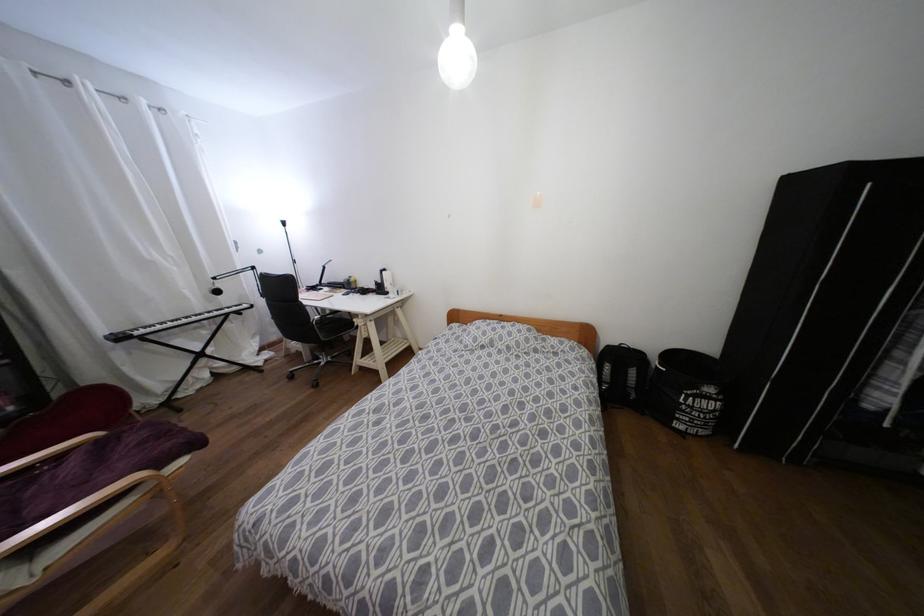
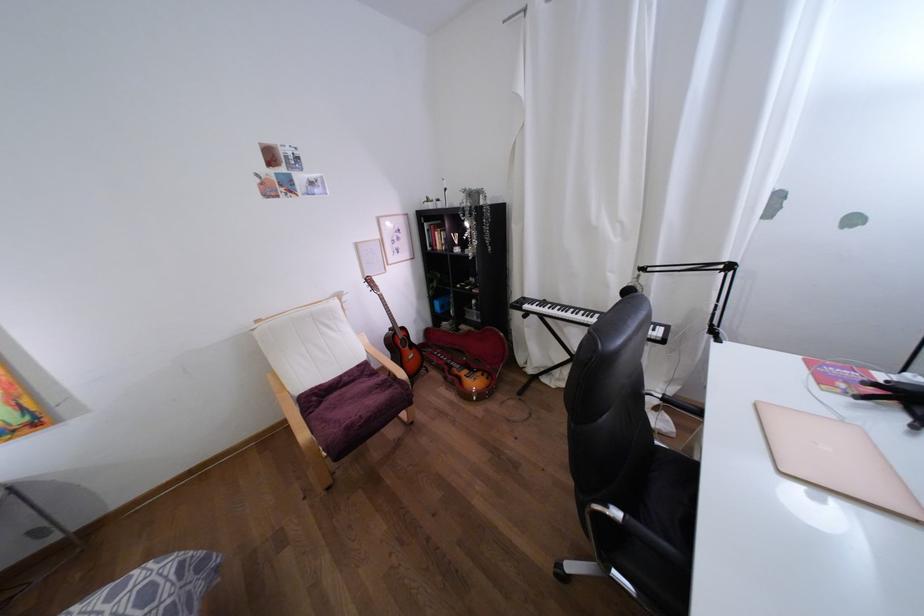
Where in the second image is the point corresponding to point (136, 333) from the first image?

(525, 306)